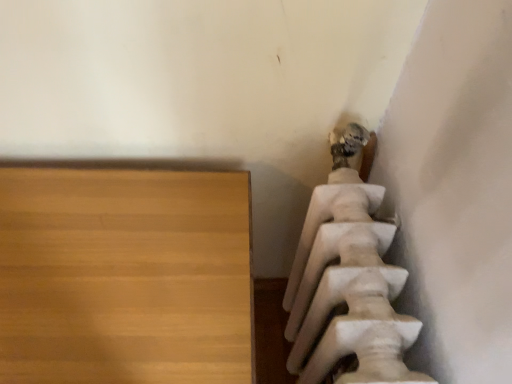
Question: Could you tell me if light brown wood table at lower left is turned towards white marble statue at upper right?

Choices:
 (A) yes
 (B) no

Answer: (B)

Question: Is white marble statue at upper right at the back of light brown wood table at lower left?

Choices:
 (A) no
 (B) yes

Answer: (A)

Question: Is light brown wood table at lower left thinner than white marble statue at upper right?

Choices:
 (A) yes
 (B) no

Answer: (B)

Question: From a real-world perspective, is light brown wood table at lower left below white marble statue at upper right?

Choices:
 (A) no
 (B) yes

Answer: (B)

Question: Is light brown wood table at lower left positioned beyond the bounds of white marble statue at upper right?

Choices:
 (A) yes
 (B) no

Answer: (A)

Question: Is white marble statue at upper right located within light brown wood table at lower left?

Choices:
 (A) no
 (B) yes

Answer: (A)

Question: Is white marble statue at upper right bigger than light brown wood table at lower left?

Choices:
 (A) no
 (B) yes

Answer: (A)

Question: Is white marble statue at upper right facing towards light brown wood table at lower left?

Choices:
 (A) yes
 (B) no

Answer: (A)

Question: Is white marble statue at upper right far from light brown wood table at lower left?

Choices:
 (A) yes
 (B) no

Answer: (B)

Question: From a real-world perspective, does white marble statue at upper right stand above light brown wood table at lower left?

Choices:
 (A) no
 (B) yes

Answer: (B)

Question: Is white marble statue at upper right further to the viewer compared to light brown wood table at lower left?

Choices:
 (A) yes
 (B) no

Answer: (B)

Question: Is white marble statue at upper right oriented away from light brown wood table at lower left?

Choices:
 (A) no
 (B) yes

Answer: (A)

Question: Is light brown wood table at lower left wider or thinner than white marble statue at upper right?

Choices:
 (A) thin
 (B) wide

Answer: (B)